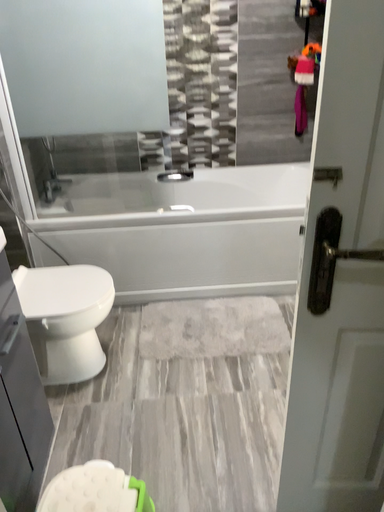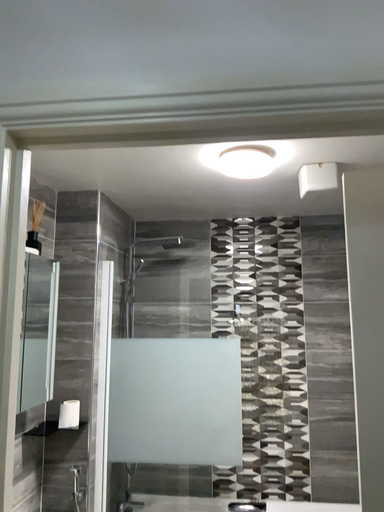
Question: Which way did the camera rotate in the video?

Choices:
 (A) rotated downward
 (B) rotated upward

Answer: (B)